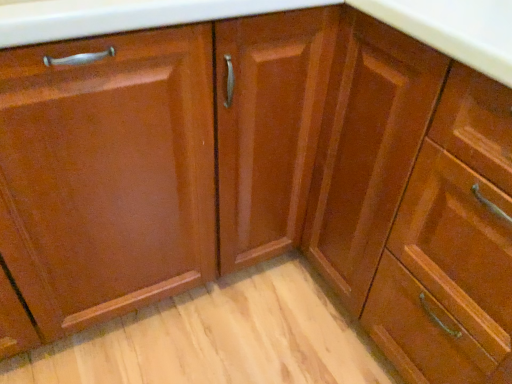
Locate an element on the screen. This screenshot has width=512, height=384. white glossy countertop at upper left is located at coordinates (276, 11).

This screenshot has width=512, height=384. What do you see at coordinates (276, 11) in the screenshot?
I see `white glossy countertop at upper left` at bounding box center [276, 11].

Where is `white glossy countertop at upper left`? The width and height of the screenshot is (512, 384). white glossy countertop at upper left is located at coordinates (276, 11).